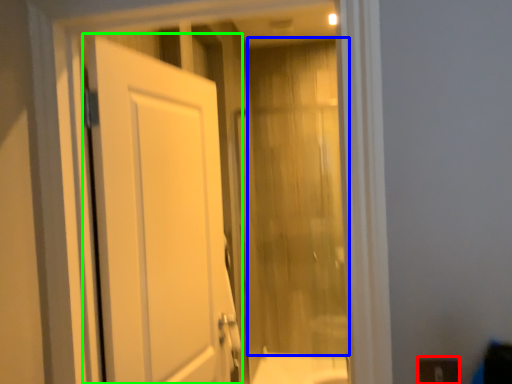
Question: Which object is positioned farthest from electric outlet (highlighted by a red box)? Select from curtain (highlighted by a blue box) and door (highlighted by a green box).

Choices:
 (A) curtain
 (B) door

Answer: (A)